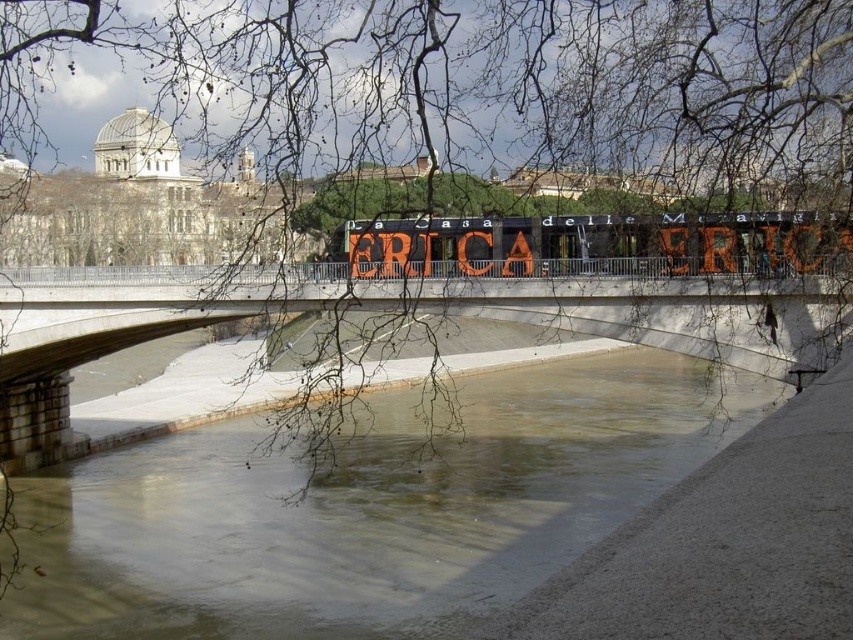
You are a city planner reviewing the urban layout. The brown concrete river at center and the concrete bridge at center are both part of the design. Which one occupies a larger area in the image?

The brown concrete river at center is larger in size than the concrete bridge at center, so it occupies a larger area in the image.

You are a drone operator trying to capture a photo of the concrete bridge at center from directly above. According to the coordinates provided, where should you position your drone to get the best shot?

The concrete bridge at center is located at coordinates point [416,310], so you should position your drone directly above that point to capture the best shot.

You are a photographer planning to capture the orange painted sign at center and the brown concrete river at center in a single frame. Based on their heights, which object will appear larger in the photo?

The brown concrete river at center has a greater height compared to the orange painted sign at center, so it will appear larger in the photo.